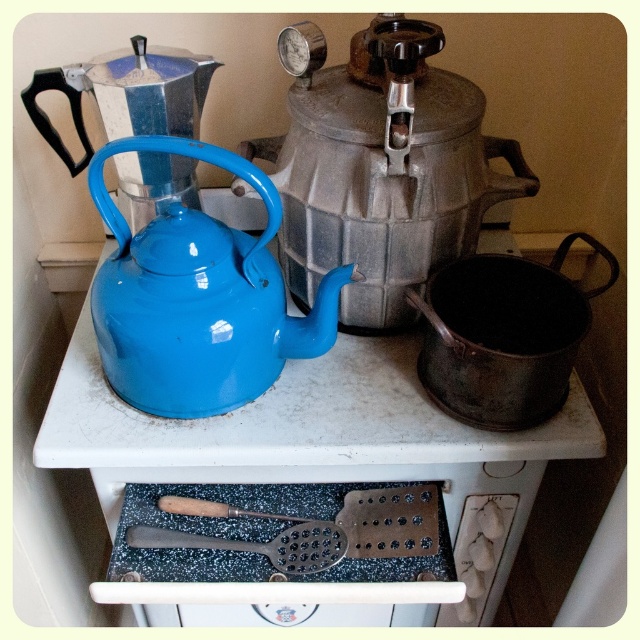
You are a tea lover who wants to pour hot water from the blue enamel kettle at upper left into the metallic silver teapot at center. Given that the kettle can tilt up to 45 degrees without spilling, what is the minimum distance you need to move the kettle horizontally to ensure the water flows smoothly into the teapot?

The blue enamel kettle at upper left and metallic silver teapot at center are 8.54 inches apart. To pour water without spilling, tilt the kettle at 45 degrees, so the horizontal distance needed is 8.54 divided by sqrt2, which is approximately 6 inches. Thus, moving the kettle about 6 inches horizontally should suffice.

Looking at this image, you are arranging items on a stove and have a blue enamel kettle at upper left and a matte enamel teapot at center. Which item is positioned to the right of the other?

The blue enamel kettle at upper left is to the right of the matte enamel teapot at center.